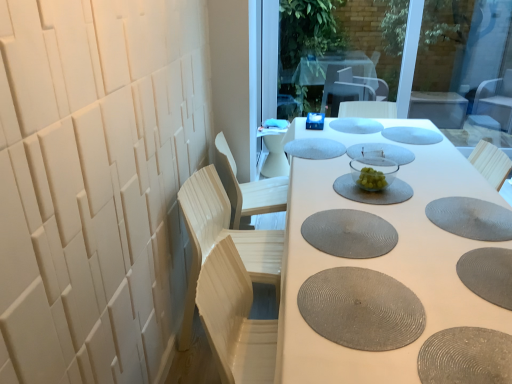
Locate an element on the screen. vacant space that's between gray textured placemat at center, placed as the seventh manhole cover when sorted from back to front, and clear glass bowl at center is located at coordinates (349, 199).